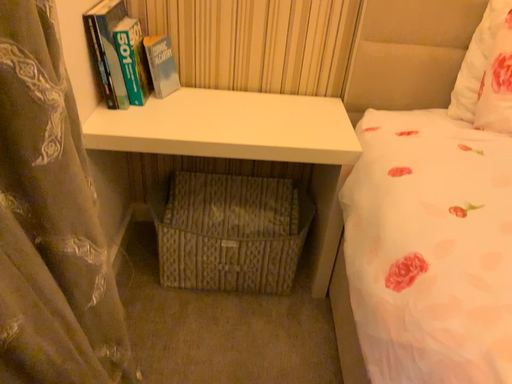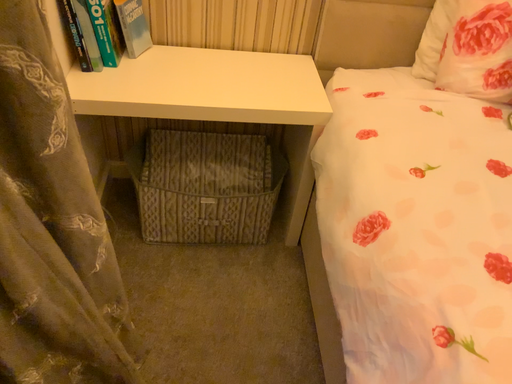
Question: How did the camera likely rotate when shooting the video?

Choices:
 (A) rotated downward
 (B) rotated upward

Answer: (A)